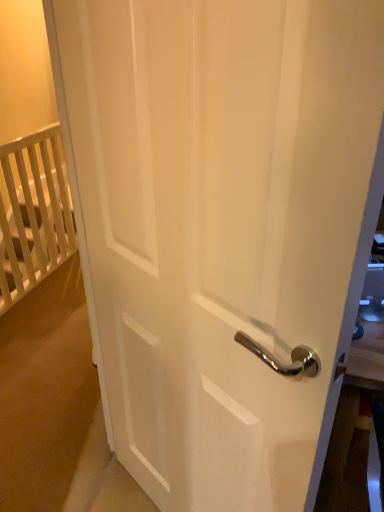
Find the location of a particular element. This screenshot has height=512, width=384. white wooden crib at left is located at coordinates (33, 213).

What do you see at coordinates (33, 213) in the screenshot? I see `white wooden crib at left` at bounding box center [33, 213].

Find the location of a particular element. This screenshot has width=384, height=512. white wooden crib at left is located at coordinates (33, 213).